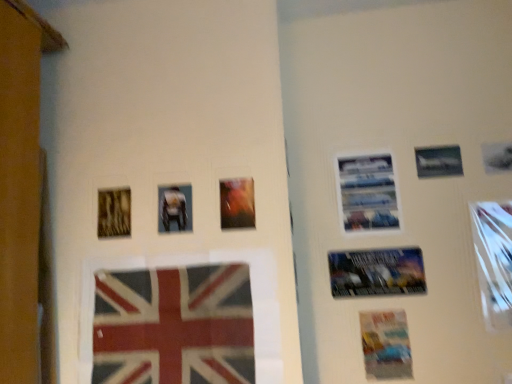
Question: Is textured fabric flag at lower center shorter than matte paper poster at lower right, marked as the third poster in a top-to-bottom arrangement?

Choices:
 (A) no
 (B) yes

Answer: (A)

Question: From the image's perspective, would you say textured fabric flag at lower center is shown under matte paper poster at lower right, marked as the third poster in a top-to-bottom arrangement?

Choices:
 (A) yes
 (B) no

Answer: (B)

Question: Is textured fabric flag at lower center far away from matte paper poster at lower right, marked as the third poster in a top-to-bottom arrangement?

Choices:
 (A) no
 (B) yes

Answer: (A)

Question: From the image's perspective, is textured fabric flag at lower center over matte paper poster at lower right, the first poster when ordered from bottom to top?

Choices:
 (A) yes
 (B) no

Answer: (A)

Question: Does textured fabric flag at lower center have a lesser width compared to matte paper poster at lower right, the first poster when ordered from bottom to top?

Choices:
 (A) no
 (B) yes

Answer: (A)

Question: Can you confirm if textured fabric flag at lower center is wider than matte paper poster at lower right, marked as the third poster in a top-to-bottom arrangement?

Choices:
 (A) yes
 (B) no

Answer: (A)

Question: Is textured fabric flag at lower center far from metallic silver poster at center right, the 2th poster when ordered from bottom to top?

Choices:
 (A) yes
 (B) no

Answer: (B)

Question: From the image's perspective, does textured fabric flag at lower center appear higher than metallic silver poster at center right, which appears as the 2th poster when viewed from the top?

Choices:
 (A) yes
 (B) no

Answer: (B)

Question: Is textured fabric flag at lower center wider than metallic silver poster at center right, which appears as the 2th poster when viewed from the top?

Choices:
 (A) yes
 (B) no

Answer: (A)

Question: Is textured fabric flag at lower center next to metallic silver poster at center right, the 2th poster when ordered from bottom to top, and touching it?

Choices:
 (A) no
 (B) yes

Answer: (A)

Question: Is textured fabric flag at lower center closer to the viewer compared to metallic silver poster at center right, the 2th poster when ordered from bottom to top?

Choices:
 (A) no
 (B) yes

Answer: (B)

Question: From a real-world perspective, is textured fabric flag at lower center on top of metallic silver poster at center right, which appears as the 2th poster when viewed from the top?

Choices:
 (A) no
 (B) yes

Answer: (A)

Question: Considering the relative sizes of metallic silver airplane at upper right, marked as the 3th picture frame in a right-to-left arrangement, and metallic silver picture frame at right, which appears as the sixth picture frame when viewed from the left, in the image provided, is metallic silver airplane at upper right, marked as the 3th picture frame in a right-to-left arrangement, smaller than metallic silver picture frame at right, which appears as the sixth picture frame when viewed from the left,?

Choices:
 (A) yes
 (B) no

Answer: (A)